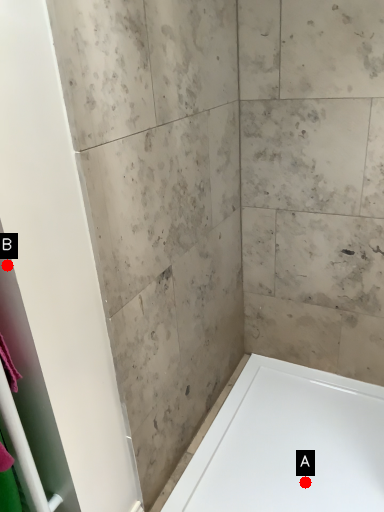
Question: Two points are circled on the image, labeled by A and B beside each circle. Which point is closer to the camera taking this photo?

Choices:
 (A) A is closer
 (B) B is closer

Answer: (B)